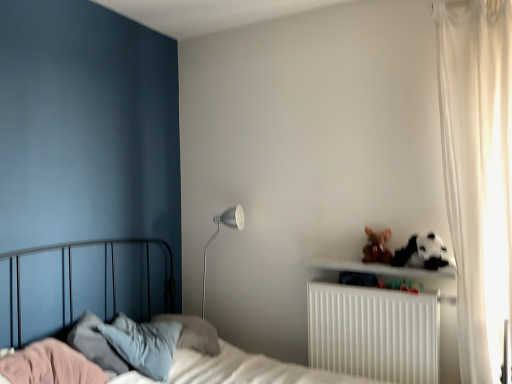
Question: From a real-world perspective, is white sheer curtain at right on top of brown plush toy at upper right?

Choices:
 (A) no
 (B) yes

Answer: (B)

Question: Are white sheer curtain at right and brown plush toy at upper right far apart?

Choices:
 (A) yes
 (B) no

Answer: (B)

Question: Considering the relative positions of white sheer curtain at right and brown plush toy at upper right in the image provided, is white sheer curtain at right to the right of brown plush toy at upper right from the viewer's perspective?

Choices:
 (A) no
 (B) yes

Answer: (B)

Question: Would you say white sheer curtain at right is outside brown plush toy at upper right?

Choices:
 (A) no
 (B) yes

Answer: (B)

Question: Does white sheer curtain at right have a lesser height compared to brown plush toy at upper right?

Choices:
 (A) yes
 (B) no

Answer: (B)

Question: From the image's perspective, is brown plush toy at upper right located above or below silver metallic floor lamp at center-left?

Choices:
 (A) above
 (B) below

Answer: (A)

Question: Is brown plush toy at upper right spatially inside silver metallic floor lamp at center-left, or outside of it?

Choices:
 (A) outside
 (B) inside

Answer: (A)

Question: Considering their positions, is brown plush toy at upper right located in front of or behind silver metallic floor lamp at center-left?

Choices:
 (A) front
 (B) behind

Answer: (A)

Question: Considering the relative positions of brown plush toy at upper right and silver metallic floor lamp at center-left in the image provided, is brown plush toy at upper right to the left or to the right of silver metallic floor lamp at center-left?

Choices:
 (A) left
 (B) right

Answer: (B)

Question: In terms of width, does silver metallic floor lamp at center-left look wider or thinner when compared to white plastic radiator at lower right?

Choices:
 (A) wide
 (B) thin

Answer: (B)

Question: Is silver metallic floor lamp at center-left to the left or to the right of white plastic radiator at lower right in the image?

Choices:
 (A) right
 (B) left

Answer: (B)

Question: In the image, is silver metallic floor lamp at center-left positioned in front of or behind white plastic radiator at lower right?

Choices:
 (A) front
 (B) behind

Answer: (B)

Question: From the image's perspective, is silver metallic floor lamp at center-left above or below white plastic radiator at lower right?

Choices:
 (A) above
 (B) below

Answer: (A)

Question: Is white sheer curtain at right wider or thinner than metallic bed at left?

Choices:
 (A) thin
 (B) wide

Answer: (A)

Question: In the image, is white sheer curtain at right on the left side or the right side of metallic bed at left?

Choices:
 (A) right
 (B) left

Answer: (A)